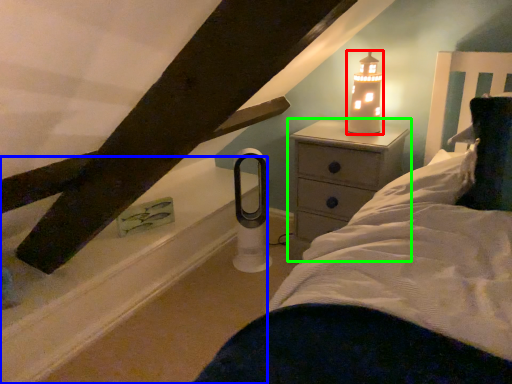
Question: Based on their relative distances, which object is nearer to candle holder (highlighted by a red box)? Choose from window sill (highlighted by a blue box) and nightstand (highlighted by a green box).

Choices:
 (A) window sill
 (B) nightstand

Answer: (B)